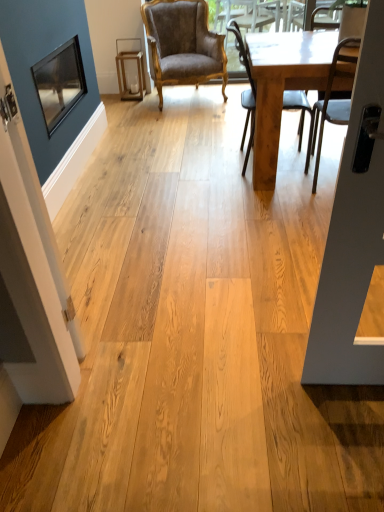
What are the coordinates of `light brown wooden table at right` in the screenshot? It's located at (282, 86).

Describe the element at coordinates (334, 99) in the screenshot. I see `metallic silver chair at right, arranged as the first chair when viewed from the front` at that location.

The width and height of the screenshot is (384, 512). What do you see at coordinates (245, 91) in the screenshot? I see `light brown wooden chair at center, which ranks as the second chair in right-to-left order` at bounding box center [245, 91].

Identify the location of matte black window screen at upper left. The height and width of the screenshot is (512, 384). (x=59, y=82).

Find the location of a particular element. This screenshot has height=512, width=384. matte black screen door at left is located at coordinates (34, 280).

Which is less distant, (257,189) or (26,306)?

Clearly, point (257,189) is more distant from the camera than point (26,306).

Considering the sizes of light brown wooden table at right and matte black screen door at left in the image, is light brown wooden table at right wider or thinner than matte black screen door at left?

Clearly, light brown wooden table at right has more width compared to matte black screen door at left.

From the picture: Is light brown wooden table at right oriented away from matte black screen door at left?

No, light brown wooden table at right is not facing away from matte black screen door at left.

Between light brown wooden table at right and matte black screen door at left, which one has more height?

matte black screen door at left is taller.

Consider the image. From the image's perspective, is light brown wooden table at right above metallic silver chair at right, which is the 3th chair from back to front?

Yes, from the image's perspective, light brown wooden table at right is on top of metallic silver chair at right, which is the 3th chair from back to front.

In the image, is light brown wooden table at right on the left side or the right side of metallic silver chair at right, arranged as the first chair when viewed from the front?

light brown wooden table at right is positioned on metallic silver chair at right, arranged as the first chair when viewed from the front,'s left side.

Is metallic silver chair at right, the 3th chair from the left, completely or partially inside light brown wooden table at right?

Indeed, metallic silver chair at right, the 3th chair from the left, is located within light brown wooden table at right.

Which of these two, matte black screen door at left or velvet brown armchair at center, which is the third chair from right to left, is thinner?

Thinner between the two is matte black screen door at left.

Where is `screen door on the left of velvet brown armchair at center, arranged as the third chair when viewed from the front`? This screenshot has height=512, width=384. screen door on the left of velvet brown armchair at center, arranged as the third chair when viewed from the front is located at coordinates (34, 280).

Is metallic silver chair at right, arranged as the first chair when viewed from the front, not inside matte black screen door at left?

That's correct, metallic silver chair at right, arranged as the first chair when viewed from the front, is outside of matte black screen door at left.

Based on the photo, is there a large distance between metallic silver chair at right, arranged as the first chair when viewed from the front, and matte black screen door at left?

metallic silver chair at right, arranged as the first chair when viewed from the front, is positioned a significant distance from matte black screen door at left.

Identify the location of screen door in front of the metallic silver chair at right, the 3th chair from the left. The width and height of the screenshot is (384, 512). (34, 280).

Which object is thinner, metallic silver chair at right, which is the 1th chair in right-to-left order, or matte black screen door at left?

matte black screen door at left.

The image size is (384, 512). What are the coordinates of `table that is under the light brown wooden chair at center, which ranks as the second chair in right-to-left order (from a real-world perspective)` in the screenshot? It's located at (282, 86).

Is light brown wooden table at right turned away from light brown wooden chair at center, which ranks as the second chair in right-to-left order?

Correct, light brown wooden table at right is looking away from light brown wooden chair at center, which ranks as the second chair in right-to-left order.

Which is in front, point (305, 66) or point (243, 61)?

The point (305, 66) is in front.

From a real-world perspective, which is physically above, light brown wooden table at right or matte black window screen at upper left?

From a 3D spatial view, matte black window screen at upper left is above.

Which is behind, point (304, 52) or point (52, 128)?

The point (52, 128) is farther from the camera.

Where is `window screen behind the light brown wooden table at right`? This screenshot has height=512, width=384. window screen behind the light brown wooden table at right is located at coordinates (59, 82).

From the image's perspective, which object appears higher, light brown wooden table at right or matte black window screen at upper left?

matte black window screen at upper left is shown above in the image.

Is matte black screen door at left located outside light brown wooden chair at center, marked as the 2th chair in a back-to-front arrangement?

Yes.

Between matte black screen door at left and light brown wooden chair at center, which ranks as the second chair in right-to-left order, which one has larger width?

Wider between the two is light brown wooden chair at center, which ranks as the second chair in right-to-left order.

From the image's perspective, is matte black screen door at left located above light brown wooden chair at center, which ranks as the second chair in right-to-left order?

No, from the image's perspective, matte black screen door at left is not over light brown wooden chair at center, which ranks as the second chair in right-to-left order.

Does point (70, 334) come closer to viewer compared to point (298, 106)?

That is True.

Find the location of a particular element. screen door in front of the light brown wooden table at right is located at coordinates (34, 280).

Locate an element on the screen. This screenshot has width=384, height=512. chair on the right of light brown wooden table at right is located at coordinates (334, 99).

Consider the image. Estimate the real-world distances between objects in this image. Which object is closer to matte black screen door at left, matte black window screen at upper left or light brown wooden chair at center, which ranks as the second chair in right-to-left order?

matte black window screen at upper left is closer to matte black screen door at left.

Estimate the real-world distances between objects in this image. Which object is closer to metallic silver chair at right, which is the 3th chair from back to front, velvet brown armchair at center, which appears as the first chair when viewed from the left, or matte black window screen at upper left?

Based on the image, matte black window screen at upper left appears to be nearer to metallic silver chair at right, which is the 3th chair from back to front.

From the image, which object appears to be farther from velvet brown armchair at center, which is the third chair from right to left, light brown wooden chair at center, marked as the 2th chair in a back-to-front arrangement, or metallic silver chair at right, the 3th chair from the left?

The object further to velvet brown armchair at center, which is the third chair from right to left, is metallic silver chair at right, the 3th chair from the left.

Which object lies further to the anchor point light brown wooden table at right, light brown wooden chair at center, which is the 2th chair in left-to-right order, or velvet brown armchair at center, which is the third chair from right to left?

velvet brown armchair at center, which is the third chair from right to left, is positioned further to the anchor light brown wooden table at right.

Looking at the image, which one is located closer to light brown wooden table at right, matte black window screen at upper left or matte black screen door at left?

Based on the image, matte black window screen at upper left appears to be nearer to light brown wooden table at right.

Estimate the real-world distances between objects in this image. Which object is closer to metallic silver chair at right, which is the 3th chair from back to front, light brown wooden chair at center, arranged as the 2th chair when viewed from the front, or matte black screen door at left?

Among the two, light brown wooden chair at center, arranged as the 2th chair when viewed from the front, is located nearer to metallic silver chair at right, which is the 3th chair from back to front.

When comparing their distances from velvet brown armchair at center, which is the third chair from right to left, does metallic silver chair at right, which is the 3th chair from back to front, or matte black screen door at left seem further?

The object further to velvet brown armchair at center, which is the third chair from right to left, is matte black screen door at left.

From the image, which object appears to be nearer to matte black screen door at left, metallic silver chair at right, the 3th chair from the left, or light brown wooden table at right?

light brown wooden table at right is closer to matte black screen door at left.

Locate an element on the screen. table between matte black screen door at left and light brown wooden chair at center, which ranks as the second chair in right-to-left order, from front to back is located at coordinates (282, 86).

Image resolution: width=384 pixels, height=512 pixels. I want to click on screen door between matte black window screen at upper left and light brown wooden table at right from left to right, so click(x=34, y=280).

You are a GUI agent. You are given a task and a screenshot of the screen. Output one action in this format:
    pyautogui.click(x=<x>, y=<y>)
    Task: Click on the chair located between metallic silver chair at right, which is the 1th chair in right-to-left order, and velvet brown armchair at center, which ranks as the 1th chair in back-to-front order, in the depth direction
    Image resolution: width=384 pixels, height=512 pixels.
    Given the screenshot: What is the action you would take?
    pyautogui.click(x=245, y=91)

The image size is (384, 512). I want to click on table between matte black screen door at left and velvet brown armchair at center, which is the third chair from right to left, in the front-back direction, so click(282, 86).